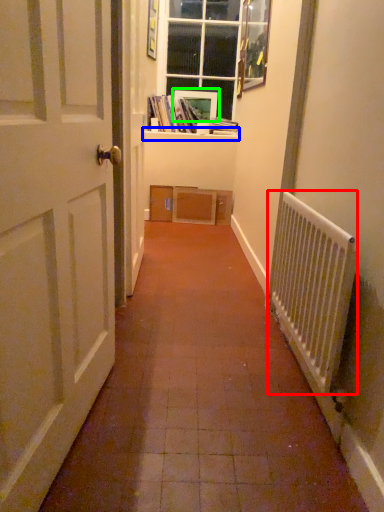
Question: Considering the real-world distances, which object is farthest from radiator (highlighted by a red box)? window sill (highlighted by a blue box) or picture frame (highlighted by a green box)?

Choices:
 (A) window sill
 (B) picture frame

Answer: (B)